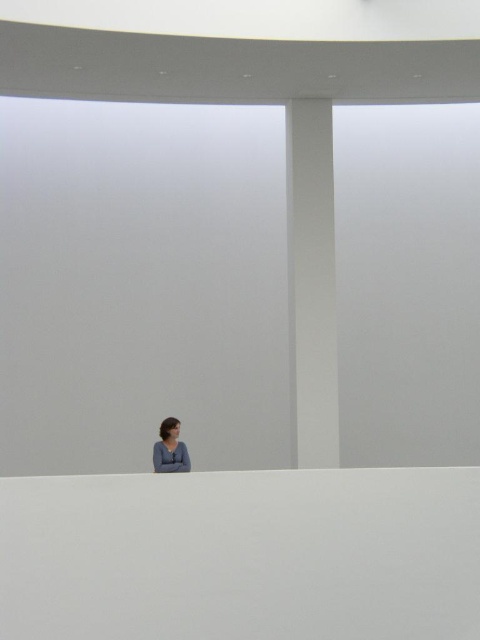
Can you confirm if white smooth pillar at right is shorter than matte gray sweater at lower center?

No.

Identify the location of white smooth pillar at right. The height and width of the screenshot is (640, 480). (312, 282).